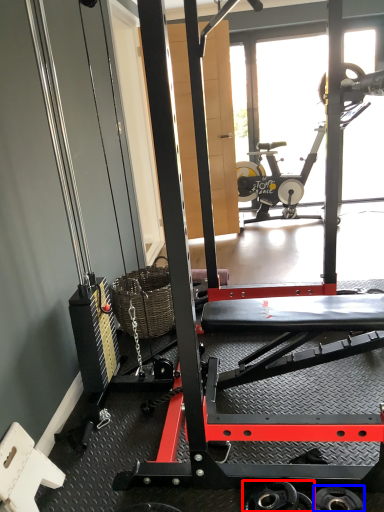
Question: Which object appears closest to the camera in this image, wheel (highlighted by a red box) or wheel (highlighted by a blue box)?

Choices:
 (A) wheel
 (B) wheel

Answer: (A)